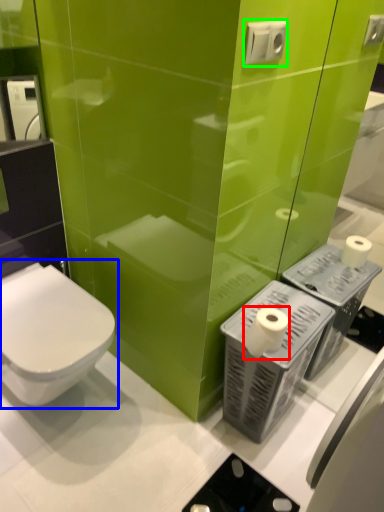
Question: Which object is the farthest from toilet paper (highlighted by a red box)? Choose among these: toilet (highlighted by a blue box) or electric outlet (highlighted by a green box).

Choices:
 (A) toilet
 (B) electric outlet

Answer: (B)